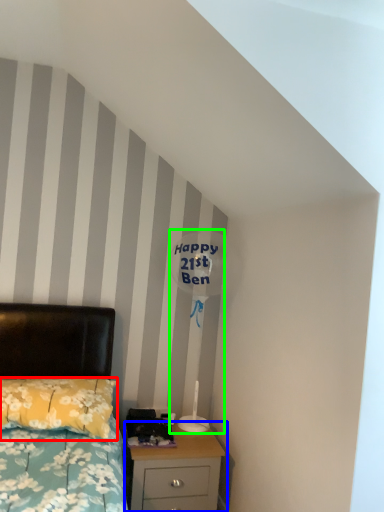
Question: Considering the real-world distances, which object is farthest from pillow (highlighted by a red box)? nightstand (highlighted by a blue box) or table lamp (highlighted by a green box)?

Choices:
 (A) nightstand
 (B) table lamp

Answer: (B)